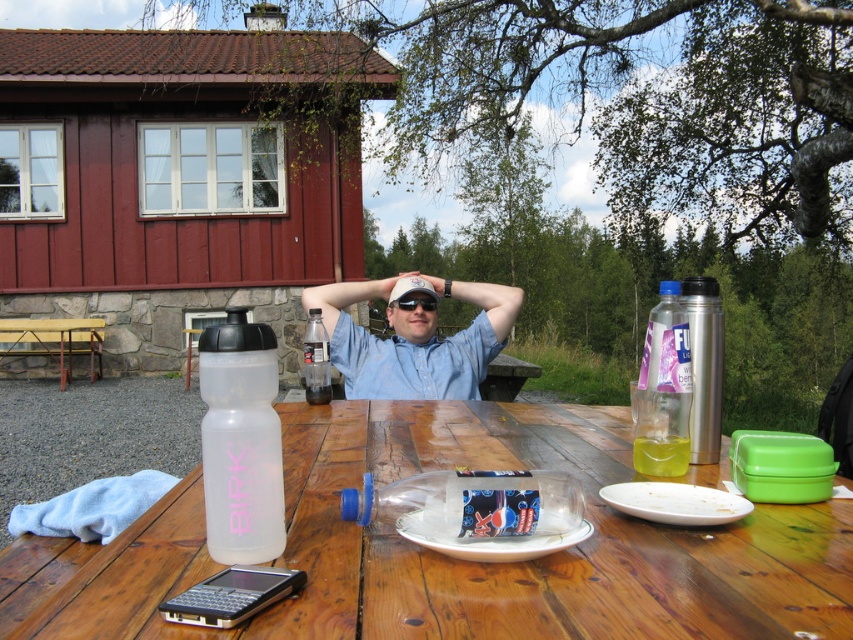
Is blue cotton shirt at center closer to camera compared to white matte cap at center?

Yes, it is in front of white matte cap at center.

Is blue cotton shirt at center to the left of white matte cap at center from the viewer's perspective?

Indeed, blue cotton shirt at center is positioned on the left side of white matte cap at center.

Find the location of `blue cotton shirt at center`. blue cotton shirt at center is located at coordinates (415, 336).

Is blue cotton shirt at center further to camera compared to black plastic goggles at center?

No.

Is blue cotton shirt at center above black plastic goggles at center?

No.

Where is `blue cotton shirt at center`? The image size is (853, 640). blue cotton shirt at center is located at coordinates (415, 336).

Does translucent plastic bottle at right have a greater width compared to white plastic plate at center?

In fact, translucent plastic bottle at right might be narrower than white plastic plate at center.

Is point (688, 401) less distant than point (396, 529)?

No, (688, 401) is further to viewer.

Is point (651, 394) farther from viewer compared to point (590, 529)?

Yes, point (651, 394) is farther from viewer.

Find the location of a particular element. translucent plastic bottle at right is located at coordinates (663, 388).